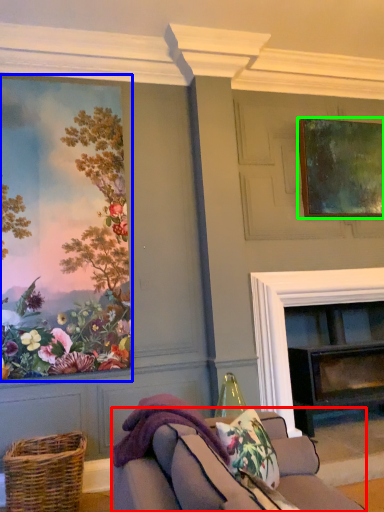
Question: Considering the real-world distances, which object is closest to studio couch (highlighted by a red box)? picture frame (highlighted by a blue box) or picture frame (highlighted by a green box).

Choices:
 (A) picture frame
 (B) picture frame

Answer: (A)